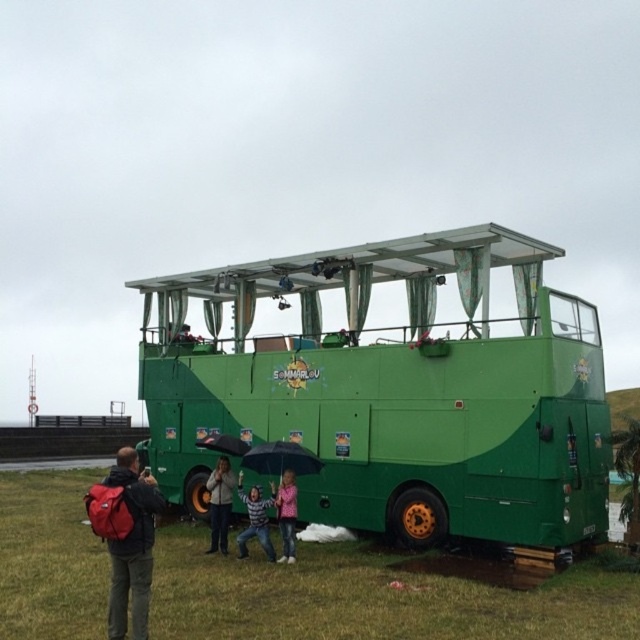
Question: Estimate the real-world distances between objects in this image. Which object is farther from the pink fabric jacket at center?

Choices:
 (A) green matte bus at center
 (B) transparent fabric umbrella at center

Answer: (A)

Question: Is red backpack at lower left below transparent fabric umbrella at center?

Choices:
 (A) yes
 (B) no

Answer: (A)

Question: Does green grass at lower left come behind pink fabric jacket at center?

Choices:
 (A) no
 (B) yes

Answer: (A)

Question: Based on their relative distances, which object is nearer to the striped sweater at center?

Choices:
 (A) green grass at lower left
 (B) pink fabric jacket at center

Answer: (B)

Question: Which of these objects is positioned farthest from the pink fabric jacket at center?

Choices:
 (A) striped sweater at center
 (B) transparent fabric umbrella at center

Answer: (B)

Question: Does striped sweater at center have a lesser width compared to pink fabric jacket at center?

Choices:
 (A) yes
 (B) no

Answer: (B)